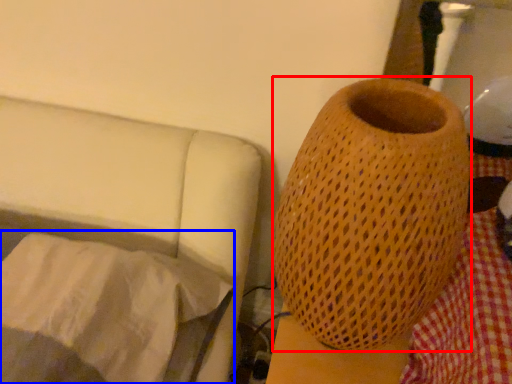
Question: Among these objects, which one is farthest to the camera, vase (highlighted by a red box) or sheet (highlighted by a blue box)?

Choices:
 (A) vase
 (B) sheet

Answer: (B)